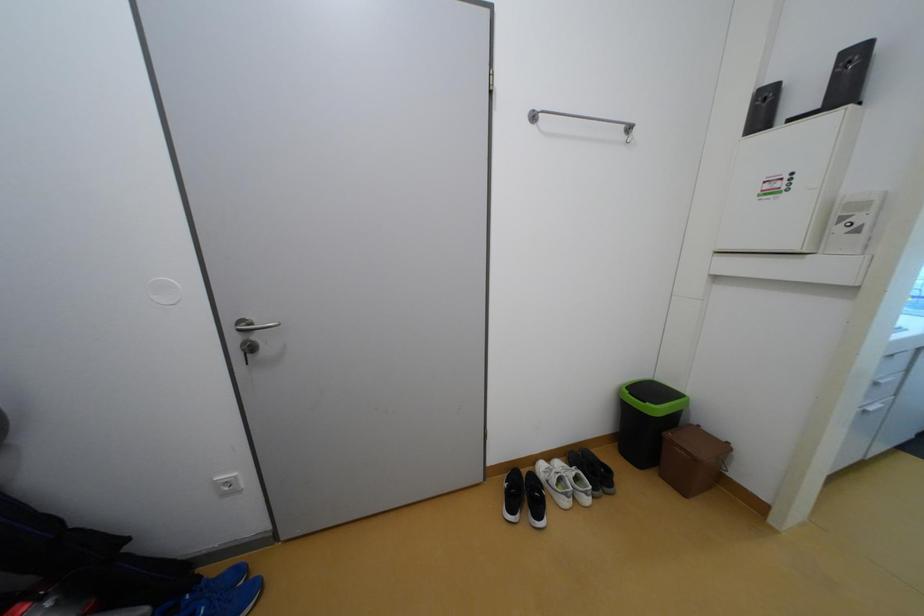
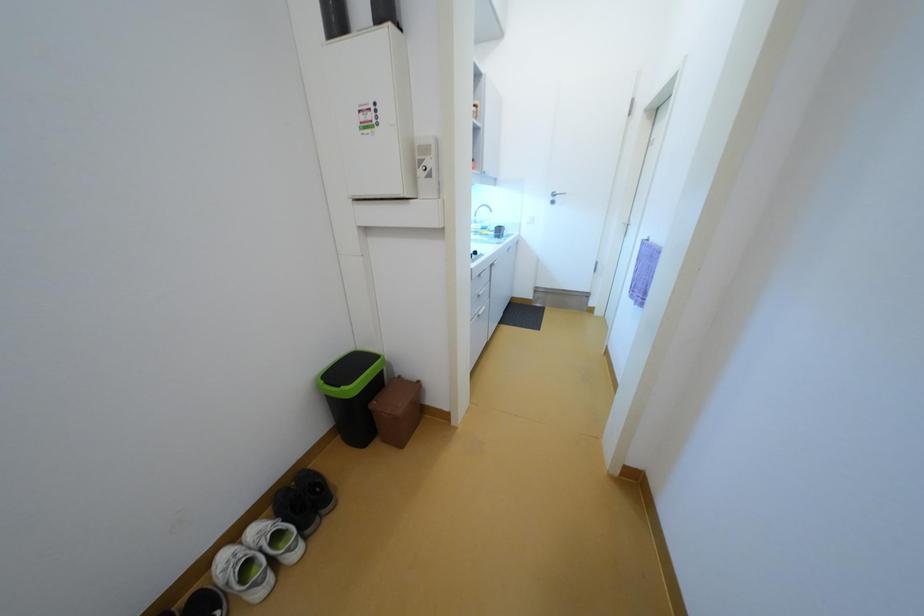
Question: Based on the continuous images, in which direction is the camera rotating? Reply with the corresponding letter.

Choices:
 (A) Left
 (B) Right
 (C) Up
 (D) Down

Answer: (B)